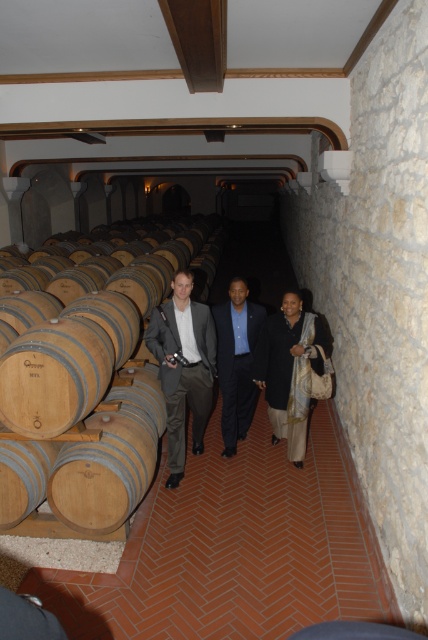
You are a tour guide leading a group through the wine cellar. You need to move from the wooden barrel at left to the matte gray suit at center. How much distance do you need to cover?

The wooden barrel at left and matte gray suit at center are 1.26 meters apart, so you need to cover 1.26 meters to move between them.

From the picture: You are standing in a wine cellar and see two suits hanging at the center of the room. The matte gray suit at center and the dark blue suit at center. Which one is nearer to you?

The matte gray suit at center is closer to the viewer than the dark blue suit at center, so the matte gray suit at center is nearer to you.

You are a tailor who needs to retrieve both the matte gray suit at center and the dark blue suit at center from the center of the corridor in a wine cellar. Which suit should you pick up first to avoid disturbing the other?

You should pick up the dark blue suit at center first because the matte gray suit at center is positioned under it, so lifting the upper one first will prevent disturbing the lower suit.